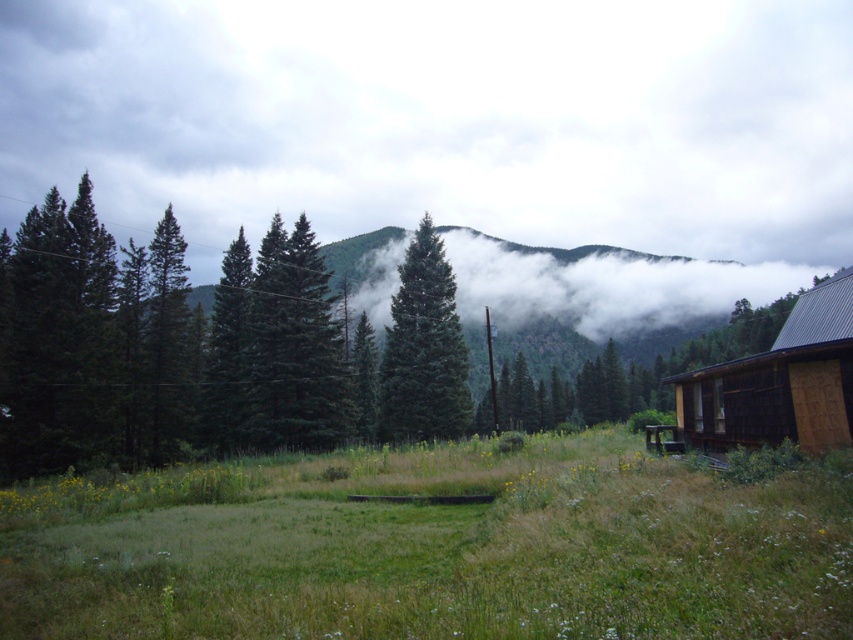
Question: Which of these objects is positioned closest to the green matte evergreen tree at center?

Choices:
 (A) green matte tree at center
 (B) wooden cabin at right
 (C) green matte tree at center-left

Answer: (A)

Question: Is green grassy field at center above wooden cabin at right?

Choices:
 (A) no
 (B) yes

Answer: (A)

Question: Does wooden cabin at right have a smaller size compared to green matte tree at center-left?

Choices:
 (A) yes
 (B) no

Answer: (A)

Question: Estimate the real-world distances between objects in this image. Which object is closer to the wooden cabin at right?

Choices:
 (A) green matte evergreen tree at center
 (B) green matte tree at center
 (C) green matte tree at center-left

Answer: (A)

Question: Is green matte evergreen tree at center to the right of green matte tree at center-left from the viewer's perspective?

Choices:
 (A) yes
 (B) no

Answer: (A)

Question: Estimate the real-world distances between objects in this image. Which object is closer to the green matte evergreen tree at center?

Choices:
 (A) wooden cabin at right
 (B) green matte tree at center-left
 (C) green grassy field at center

Answer: (B)